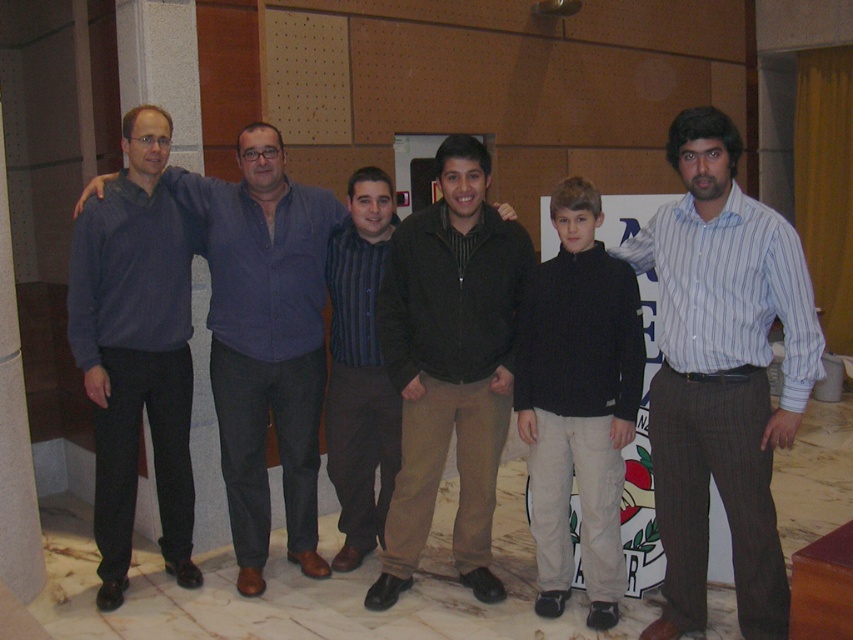
You are a photographer standing 1 meter away from the group. You want to take a closeup shot of the matte blue sweater at left and the matte blue shirt at center. Given the distance between them is 27.52 centimeters, will your camera, which has a maximum focus range of 1.5 meters, be able to capture both items clearly in the same frame?

The distance between the matte blue sweater at left and the matte blue shirt at center is 27.52 centimeters. Since the camera has a maximum focus range of 1.5 meters, which is 150 centimeters, and the separation between the two items is much smaller than that, the camera can easily capture both items clearly in the same frame.